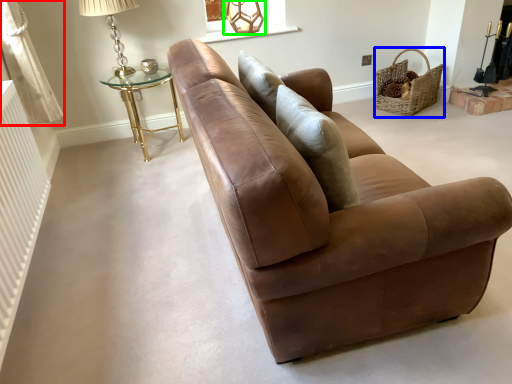
Question: Considering the real-world distances, which object is closest to curtain (highlighted by a red box)? basket (highlighted by a blue box) or table lamp (highlighted by a green box).

Choices:
 (A) basket
 (B) table lamp

Answer: (B)